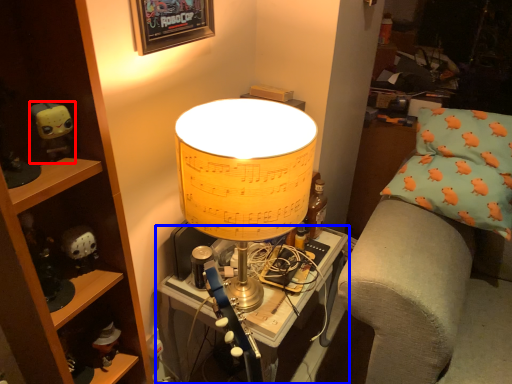
Question: Which object is closer to the camera taking this photo, toy (highlighted by a red box) or table (highlighted by a blue box)?

Choices:
 (A) toy
 (B) table

Answer: (B)